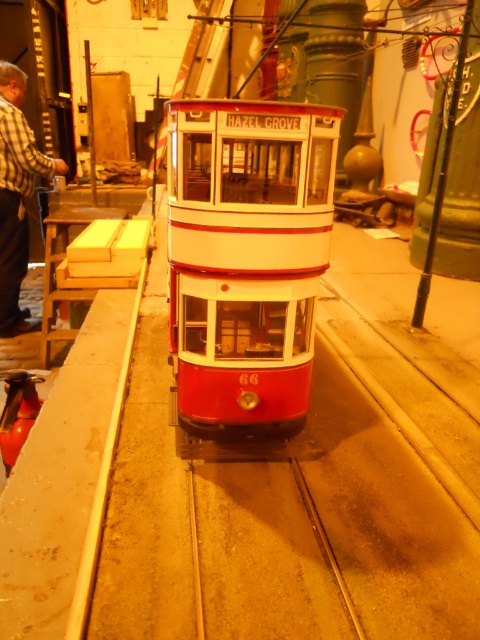
You are standing in front of the vintage tram model labeled HAZEL GROVE. There are two points marked in the image. Which of the two points, point [216,614] or point [19,144], is closer to you?

Point [216,614] is closer to you than point [19,144].